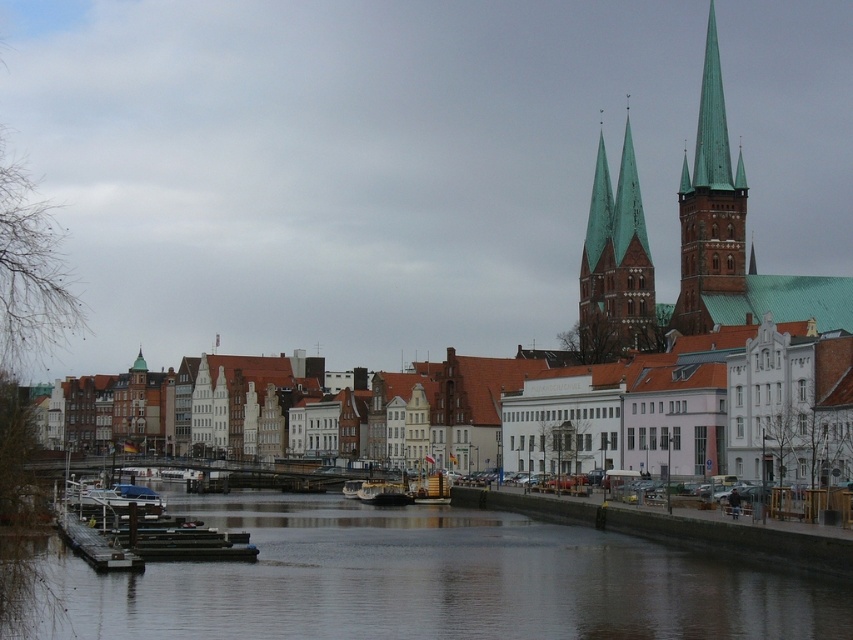
Question: Is green copper spire at upper right below metallic silver boat at center?

Choices:
 (A) yes
 (B) no

Answer: (B)

Question: Among these objects, which one is nearest to the camera?

Choices:
 (A) metallic silver boat at center
 (B) green copper spires at upper center
 (C) wooden boat at center

Answer: (C)

Question: Can you confirm if smooth concrete river at center is positioned to the left of green copper spires at upper center?

Choices:
 (A) no
 (B) yes

Answer: (B)

Question: Does white smooth buildings at center lie in front of metallic gray barge at center?

Choices:
 (A) yes
 (B) no

Answer: (A)

Question: Which object is closer to the camera taking this photo?

Choices:
 (A) green copper spires at upper center
 (B) metallic gray barge at center

Answer: (B)

Question: Which point is farther from the camera taking this photo?

Choices:
 (A) (788, 593)
 (B) (402, 502)

Answer: (B)